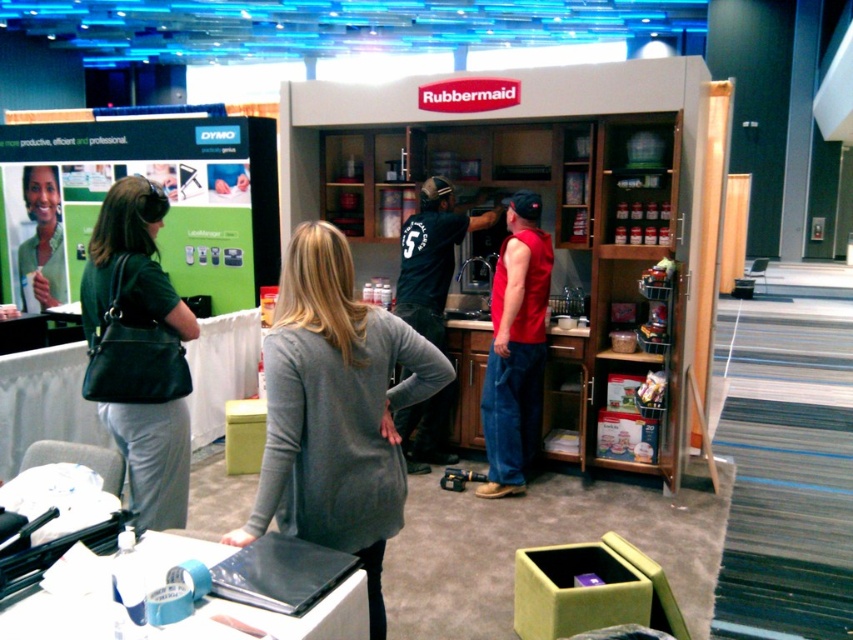
Between point (152, 244) and point (544, 288), which one is positioned in front?

Point (152, 244)

Can you confirm if black leather purse at left is smaller than red sleeveless shirt at center?

Correct, black leather purse at left occupies less space than red sleeveless shirt at center.

The image size is (853, 640). I want to click on black leather purse at left, so click(158, 349).

Where is `black leather purse at left`? Image resolution: width=853 pixels, height=640 pixels. black leather purse at left is located at coordinates (158, 349).

The image size is (853, 640). What do you see at coordinates (158, 349) in the screenshot? I see `black leather purse at left` at bounding box center [158, 349].

Is the position of black leather purse at left more distant than that of green matte shirt at upper left?

No, it is not.

Identify the location of black leather purse at left. (158, 349).

Image resolution: width=853 pixels, height=640 pixels. What do you see at coordinates (335, 410) in the screenshot?
I see `gray sweater at center` at bounding box center [335, 410].

Who is positioned more to the left, gray sweater at center or black leather purse at left?

black leather purse at left

Who is more forward, (273, 362) or (169, 525)?

Point (273, 362) is in front.

Where is `gray sweater at center`? The width and height of the screenshot is (853, 640). gray sweater at center is located at coordinates (335, 410).